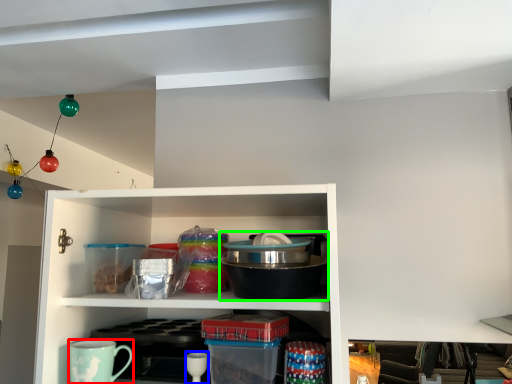
Question: Which object is the farthest from coffee cup (highlighted by a red box)? Choose among these: tableware (highlighted by a blue box) or appliance (highlighted by a green box).

Choices:
 (A) tableware
 (B) appliance

Answer: (B)